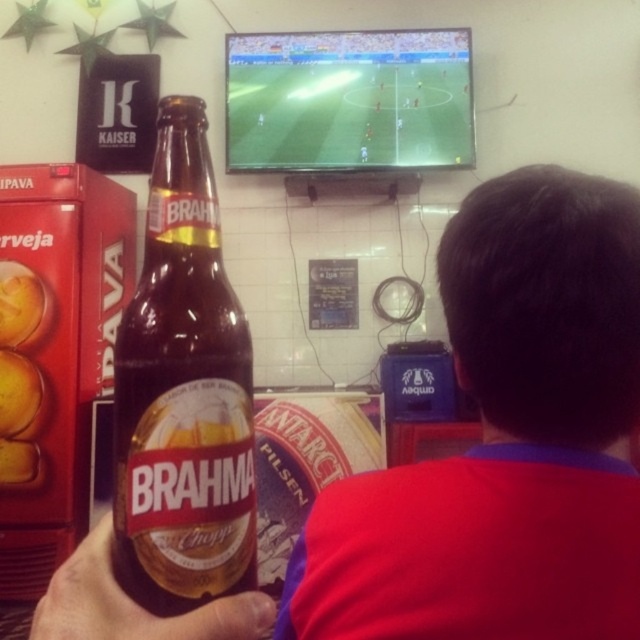
You are a delivery person who needs to place a package between the matte glass bottle at center and the green screen soccer field at upper center. The package is 6 feet long. Can you fit it between them without moving the existing objects?

The distance between the matte glass bottle at center and the green screen soccer field at upper center is 7.51 feet. Since the package is 6 feet long, it can fit between them as there is enough space.

You are a delivery person who needs to place a new Brahma beer bottle exactly where the brown glass bottle at center is currently located. What are the coordinates where you should place the new bottle?

Place the new Brahma beer bottle at coordinates point (182, 392) where the brown glass bottle at center is located.

You are a bartender who needs to place the brown glass bottle at center on the counter next to the green screen soccer field at upper center. Considering their heights, which object should you place first to ensure stability?

The brown glass bottle at center has a lesser height compared to green screen soccer field at upper center, so you should place the brown glass bottle at center first to ensure stability.